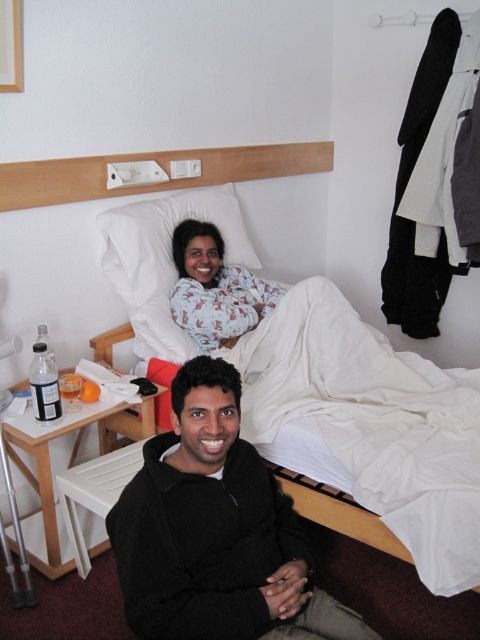
Question: Which point is closer to the camera taking this photo?

Choices:
 (A) pos(230,292)
 (B) pos(204,461)

Answer: (B)

Question: Does white cotton bed at upper center have a smaller size compared to white cotton pajamas at upper center?

Choices:
 (A) yes
 (B) no

Answer: (B)

Question: Does white cotton bed at upper center come in front of white soft pillow at upper center?

Choices:
 (A) yes
 (B) no

Answer: (A)

Question: Which of the following is the closest to the observer?

Choices:
 (A) [208, 385]
 (B) [273, 298]

Answer: (A)

Question: Which point is farther from the camera taking this photo?

Choices:
 (A) (340, 627)
 (B) (253, 288)

Answer: (B)

Question: From the image, what is the correct spatial relationship of black fleece jacket at lower center in relation to white soft pillow at upper center?

Choices:
 (A) above
 (B) below

Answer: (B)